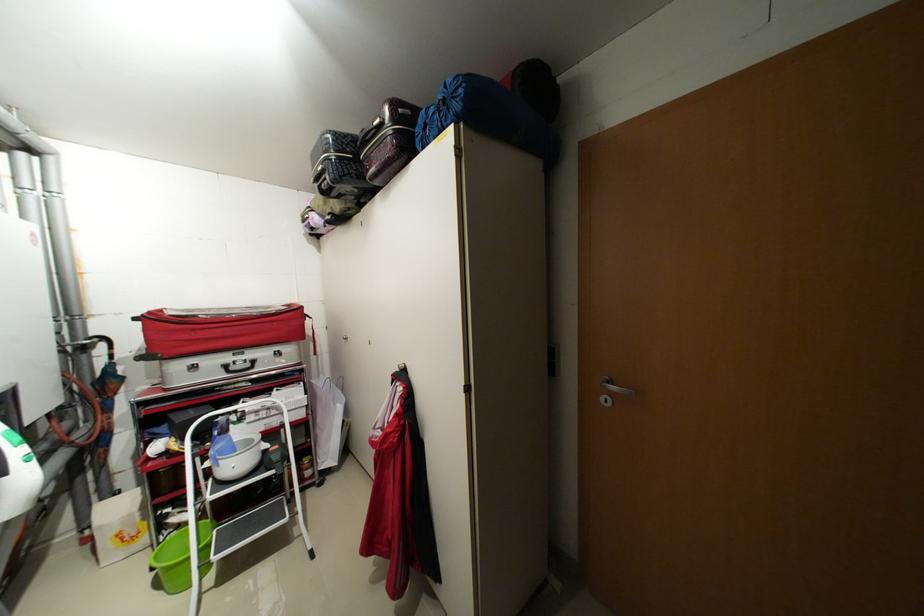
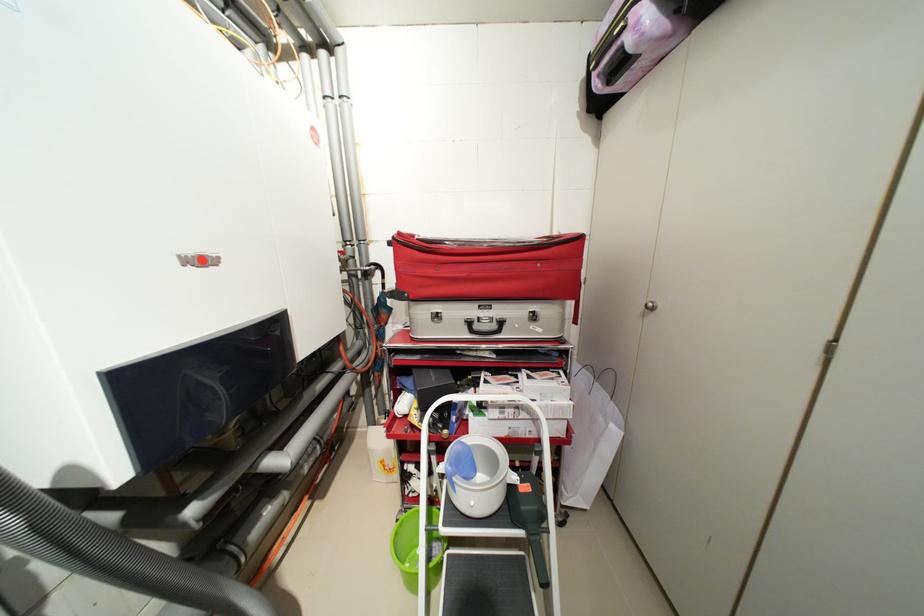
In the second image, find the point that corresponds to (x=289, y=414) in the first image.

(541, 421)